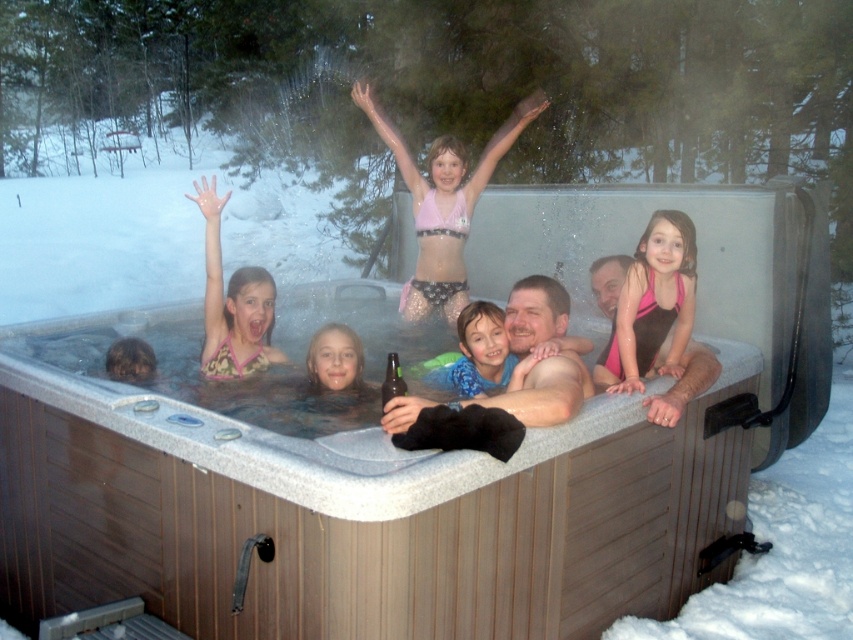
Looking at the wooden hot tub at center and the smooth skin face at center in the snowy scene, which object takes up more space?

The wooden hot tub at center is bigger than smooth skin face at center, so it takes up more space.

You are standing 6 feet away from the wooden hot tub at center. Can you comfortably reach into the hot tub to grab a towel placed on its edge?

The wooden hot tub at center is 6.63 feet away from the viewer, so you are standing 6 feet away. Since the distance between you and the hot tub is less than 6.63 feet, you can comfortably reach the towel placed on its edge.